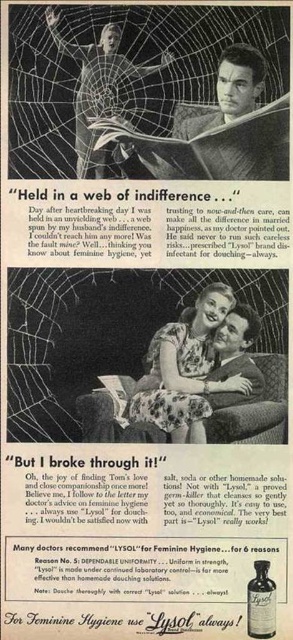
In the vintage Lysol advertisement scene, you notice a floral dress at center and a translucent glass bottle at center. Which object is located to the left of the other?

The floral dress at center is positioned on the left side of the translucent glass bottle at center.

In the top section of the vintage Lysol advertisement, you see a smooth skin man at upper right and a matte black dress at upper center. Which object takes up more visual space in the image?

The smooth skin man at upper right takes up more visual space compared to the matte black dress at upper center because he has a larger size.

In the vintage Lysol advertisement, there are two points marked on the image. The first point is at coordinates point (222, 93) and the second point is at point (275, 605). From the perspective of an observer looking at the advertisement, which point is located further back in the scene?

Point (222, 93) is behind point (275, 605), so the first point is further back in the scene.